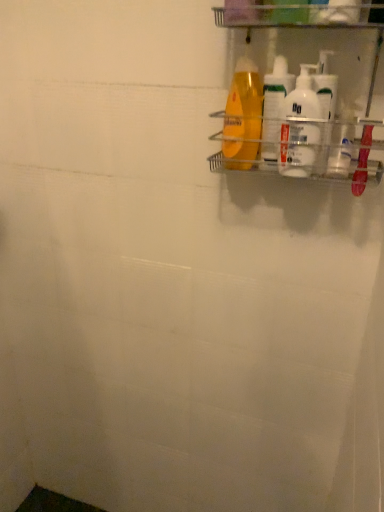
Question: Can you confirm if white plastic bottles at upper right, which is the 4th cleaning product from left to right, is positioned to the right of white glossy bottles at upper right, placed as the third cleaning product when sorted from left to right?

Choices:
 (A) yes
 (B) no

Answer: (A)

Question: Is white plastic bottles at upper right, which is the 4th cleaning product from left to right, shorter than white glossy bottles at upper right, placed as the third cleaning product when sorted from left to right?

Choices:
 (A) no
 (B) yes

Answer: (A)

Question: From a real-world perspective, is white plastic bottles at upper right, which is the 4th cleaning product from left to right, on top of white glossy bottles at upper right, the 2th cleaning product from the right?

Choices:
 (A) yes
 (B) no

Answer: (A)

Question: Is white plastic bottles at upper right, which is the 4th cleaning product from left to right, thinner than white glossy bottles at upper right, the 2th cleaning product from the right?

Choices:
 (A) yes
 (B) no

Answer: (A)

Question: Is white plastic bottles at upper right, which is the 1th cleaning product in right-to-left order, not close to white glossy bottles at upper right, placed as the third cleaning product when sorted from left to right?

Choices:
 (A) yes
 (B) no

Answer: (B)

Question: Can you confirm if white plastic bottles at upper right, which is the 1th cleaning product in right-to-left order, is bigger than white glossy bottles at upper right, placed as the third cleaning product when sorted from left to right?

Choices:
 (A) yes
 (B) no

Answer: (B)

Question: From the image's perspective, is translucent plastic bottle at upper right, the second cleaning product positioned from the left, on white glossy bottles at upper right, the 2th cleaning product from the right?

Choices:
 (A) no
 (B) yes

Answer: (B)

Question: Is translucent plastic bottle at upper right, the second cleaning product positioned from the left, aimed at white glossy bottles at upper right, placed as the third cleaning product when sorted from left to right?

Choices:
 (A) yes
 (B) no

Answer: (B)

Question: Is translucent plastic bottle at upper right, the second cleaning product positioned from the left, thinner than white glossy bottles at upper right, placed as the third cleaning product when sorted from left to right?

Choices:
 (A) no
 (B) yes

Answer: (A)

Question: From the image's perspective, does translucent plastic bottle at upper right, which is the third cleaning product from right to left, appear lower than white glossy bottles at upper right, placed as the third cleaning product when sorted from left to right?

Choices:
 (A) yes
 (B) no

Answer: (B)

Question: From a real-world perspective, is translucent plastic bottle at upper right, which is the third cleaning product from right to left, located beneath white glossy bottles at upper right, the 2th cleaning product from the right?

Choices:
 (A) yes
 (B) no

Answer: (B)

Question: From a real-world perspective, is translucent plastic bottle at upper right, which is the third cleaning product from right to left, physically above white glossy bottles at upper right, the 2th cleaning product from the right?

Choices:
 (A) yes
 (B) no

Answer: (A)

Question: From the image's perspective, is clear plastic shelf at upper right over translucent plastic shampoo bottle at upper right, marked as the fourth cleaning product in a right-to-left arrangement?

Choices:
 (A) yes
 (B) no

Answer: (A)